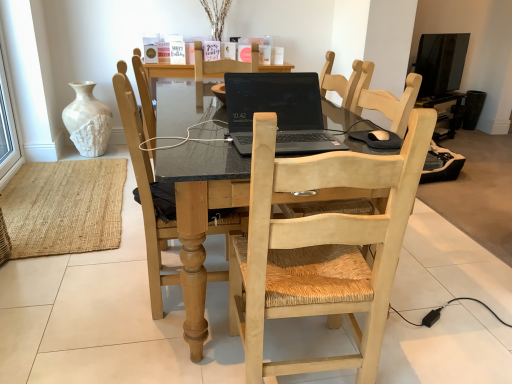
In order to face transparent glass window at left, should I rotate leftwards or rightwards?

It's best to rotate left around 32.536 degrees.

The width and height of the screenshot is (512, 384). Identify the location of transparent glass window at left. (8, 128).

Describe the element at coordinates (145, 189) in the screenshot. I see `light wood chair at center, the second chair when ordered from right to left` at that location.

What do you see at coordinates (278, 111) in the screenshot?
I see `black matte laptop at center` at bounding box center [278, 111].

Find the location of a particular element. Image resolution: width=512 pixels, height=384 pixels. light wood woven seat at center, the 2th chair in the left-to-right sequence is located at coordinates (321, 249).

Identify the location of white textured vase at upper left. This screenshot has height=384, width=512. (88, 120).

From the image's perspective, which is above, light wood chair at center, which is the 1th chair in left-to-right order, or white textured vase at upper left?

white textured vase at upper left appears higher in the image.

How many degrees apart are the facing directions of light wood chair at center, which is the 1th chair in left-to-right order, and white textured vase at upper left?

92.3 degrees.

Is light wood chair at center, the second chair when ordered from right to left, closer to the viewer compared to white textured vase at upper left?

Yes, it is in front of white textured vase at upper left.

Considering the sizes of objects light wood chair at center, the second chair when ordered from right to left, and white textured vase at upper left in the image provided, who is smaller, light wood chair at center, the second chair when ordered from right to left, or white textured vase at upper left?

white textured vase at upper left is smaller.

Is light wood chair at center, which is the 1th chair in left-to-right order, to the left of light wood woven seat at center, the 2th chair in the left-to-right sequence, from the viewer's perspective?

Correct, you'll find light wood chair at center, which is the 1th chair in left-to-right order, to the left of light wood woven seat at center, the 2th chair in the left-to-right sequence.

How many degrees apart are the facing directions of light wood chair at center, which is the 1th chair in left-to-right order, and light wood woven seat at center, arranged as the first chair when viewed from the right?

There is a 85.6-degree angle between the facing directions of light wood chair at center, which is the 1th chair in left-to-right order, and light wood woven seat at center, arranged as the first chair when viewed from the right.

From the image's perspective, is light wood chair at center, the second chair when ordered from right to left, above or below light wood woven seat at center, arranged as the first chair when viewed from the right?

Clearly, from the image's perspective, light wood chair at center, the second chair when ordered from right to left, is above light wood woven seat at center, arranged as the first chair when viewed from the right.

Which is closer to the camera, (124, 95) or (321, 293)?

Positioned in front is point (321, 293).

Image resolution: width=512 pixels, height=384 pixels. Find the location of `window screen lying on the left of black matte laptop at center`. window screen lying on the left of black matte laptop at center is located at coordinates (8, 128).

Is black matte laptop at center completely or partially outside of transparent glass window at left?

Yes, black matte laptop at center is outside of transparent glass window at left.

Which point is more distant from viewer, [251,144] or [10,133]?

Positioned behind is point [10,133].

From the image's perspective, which is below, black matte laptop at center or transparent glass window at left?

black matte laptop at center.

Is black matte laptop at center not within white textured vase at upper left?

Yes, black matte laptop at center is located beyond the bounds of white textured vase at upper left.

Which object is closer to the camera, black matte laptop at center or white textured vase at upper left?

Positioned in front is black matte laptop at center.

Where is `vase on the left of black matte laptop at center`? The width and height of the screenshot is (512, 384). vase on the left of black matte laptop at center is located at coordinates (88, 120).

Based on their sizes in the image, would you say black matte laptop at center is bigger or smaller than white textured vase at upper left?

Considering their sizes, black matte laptop at center takes up less space than white textured vase at upper left.

From a real-world perspective, which object stands above the other?

In real-world perspective, black glossy tv at upper right is above.

In terms of size, does black glossy tv at upper right appear bigger or smaller than white textured vase at upper left?

In the image, black glossy tv at upper right appears to be smaller than white textured vase at upper left.

From the image's perspective, is black glossy tv at upper right under white textured vase at upper left?

Incorrect, from the image's perspective, black glossy tv at upper right is higher than white textured vase at upper left.

Does black glossy tv at upper right touch white textured vase at upper left?

No, black glossy tv at upper right is not touching white textured vase at upper left.

Considering the relative sizes of white textured vase at upper left and light wood chair at center, the second chair when ordered from right to left, in the image provided, is white textured vase at upper left wider than light wood chair at center, the second chair when ordered from right to left,?

No, white textured vase at upper left is not wider than light wood chair at center, the second chair when ordered from right to left.

Would you say white textured vase at upper left is a long distance from light wood chair at center, the second chair when ordered from right to left?

Yes, white textured vase at upper left and light wood chair at center, the second chair when ordered from right to left, are quite far apart.

From the image's perspective, between white textured vase at upper left and light wood chair at center, the second chair when ordered from right to left, which one is located above?

white textured vase at upper left is shown above in the image.

How different are the orientations of white textured vase at upper left and light wood chair at center, the second chair when ordered from right to left, in degrees?

The angle between the facing direction of white textured vase at upper left and the facing direction of light wood chair at center, the second chair when ordered from right to left, is 92.3 degrees.

Is light wood woven seat at center, the 2th chair in the left-to-right sequence, positioned behind white textured vase at upper left?

No, it is in front of white textured vase at upper left.

Could you tell me if light wood woven seat at center, the 2th chair in the left-to-right sequence, is turned towards white textured vase at upper left?

No, light wood woven seat at center, the 2th chair in the left-to-right sequence, does not turn towards white textured vase at upper left.

From the image's perspective, is light wood woven seat at center, arranged as the first chair when viewed from the right, located above or below white textured vase at upper left?

Clearly, from the image's perspective, light wood woven seat at center, arranged as the first chair when viewed from the right, is below white textured vase at upper left.

Considering the sizes of light wood woven seat at center, arranged as the first chair when viewed from the right, and white textured vase at upper left in the image, is light wood woven seat at center, arranged as the first chair when viewed from the right, taller or shorter than white textured vase at upper left?

Clearly, light wood woven seat at center, arranged as the first chair when viewed from the right, is taller compared to white textured vase at upper left.

You are a GUI agent. You are given a task and a screenshot of the screen. Output one action in this format:
    pyautogui.click(x=<x>, y=<y>)
    Task: Click on the vase above the light wood chair at center, which is the 1th chair in left-to-right order (from the image's perspective)
    The height and width of the screenshot is (384, 512).
    Given the screenshot: What is the action you would take?
    pyautogui.click(x=88, y=120)

What are the coordinates of `chair lying behind the light wood woven seat at center, the 2th chair in the left-to-right sequence` in the screenshot? It's located at (145, 189).

Based on their spatial positions, is black matte laptop at center or light wood chair at center, which is the 1th chair in left-to-right order, further from transparent glass window at left?

Among the two, black matte laptop at center is located further to transparent glass window at left.

Considering their positions, is black matte laptop at center positioned further to black glossy tv at upper right than light wood chair at center, which is the 1th chair in left-to-right order?

Among the two, light wood chair at center, which is the 1th chair in left-to-right order, is located further to black glossy tv at upper right.

Looking at this image, estimate the real-world distances between objects in this image. Which object is further from black matte laptop at center, light wood chair at center, which is the 1th chair in left-to-right order, or light wood woven seat at center, the 2th chair in the left-to-right sequence?

The object further to black matte laptop at center is light wood woven seat at center, the 2th chair in the left-to-right sequence.

Looking at the image, which one is located further to black glossy tv at upper right, black matte laptop at center or transparent glass window at left?

transparent glass window at left is positioned further to the anchor black glossy tv at upper right.

When comparing their distances from light wood chair at center, which is the 1th chair in left-to-right order, does black glossy tv at upper right or black matte laptop at center seem closer?

black matte laptop at center is closer to light wood chair at center, which is the 1th chair in left-to-right order.

Based on their spatial positions, is black glossy tv at upper right or light wood woven seat at center, the 2th chair in the left-to-right sequence, closer to white textured vase at upper left?

light wood woven seat at center, the 2th chair in the left-to-right sequence, lies closer to white textured vase at upper left than the other object.

Looking at the image, which one is located further to white textured vase at upper left, transparent glass window at left or black glossy tv at upper right?

black glossy tv at upper right is further to white textured vase at upper left.

Considering their positions, is white textured vase at upper left positioned closer to light wood chair at center, which is the 1th chair in left-to-right order, than black matte laptop at center?

black matte laptop at center.

Where is `laptop between light wood chair at center, which is the 1th chair in left-to-right order, and light wood woven seat at center, the 2th chair in the left-to-right sequence, from left to right`? The height and width of the screenshot is (384, 512). laptop between light wood chair at center, which is the 1th chair in left-to-right order, and light wood woven seat at center, the 2th chair in the left-to-right sequence, from left to right is located at coordinates (278, 111).

At what (x,y) coordinates should I click in order to perform the action: click on laptop between light wood woven seat at center, the 2th chair in the left-to-right sequence, and black glossy tv at upper right in the front-back direction. Please return your answer as a coordinate pair (x, y). This screenshot has width=512, height=384. Looking at the image, I should click on (278, 111).

Image resolution: width=512 pixels, height=384 pixels. I want to click on chair between black matte laptop at center and white textured vase at upper left from front to back, so click(x=145, y=189).

The height and width of the screenshot is (384, 512). Identify the location of vase between transparent glass window at left and black matte laptop at center from left to right. (88, 120).